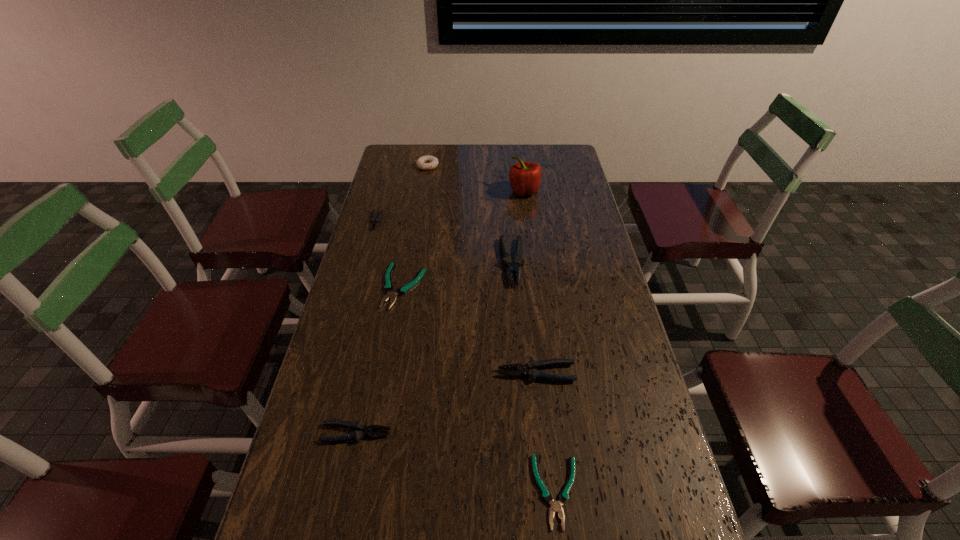
Image resolution: width=960 pixels, height=540 pixels. In the image, there is a desktop. What are the coordinates of `vacant space at the left edge` in the screenshot? It's located at (316, 448).

The image size is (960, 540). Find the location of `vacant area at the right edge`. vacant area at the right edge is located at coordinates (607, 332).

The width and height of the screenshot is (960, 540). In order to click on vacant space at the far right corner in this screenshot , I will do `click(561, 164)`.

The width and height of the screenshot is (960, 540). In order to click on unoccupied area between the third nearest gray pliers and the second tallest pliers in this screenshot , I will do `click(524, 318)`.

At what (x,y) coordinates should I click in order to perform the action: click on unoccupied position between the second nearest object and the fourth farthest pliers. Please return your answer as a coordinate pair (x, y). Image resolution: width=960 pixels, height=540 pixels. Looking at the image, I should click on (446, 403).

The width and height of the screenshot is (960, 540). Identify the location of vacant space in between the farthest pliers and the second shortest object. (390, 254).

Identify the location of free space between the nearest gray pliers and the left teal pliers. (380, 360).

Locate an element on the screen. This screenshot has height=540, width=960. vacant space that is in between the doughnut and the second shortest pliers is located at coordinates (416, 226).

Locate which object is the third closest to the white doughnut. Please provide its 2D coordinates. Your answer should be formatted as a tuple, i.e. [(x, y)], where the tuple contains the x and y coordinates of a point satisfying the conditions above.

[(512, 268)]

The image size is (960, 540). What are the coordinates of `object that is the fifth closest to the farthest pliers` in the screenshot? It's located at (529, 369).